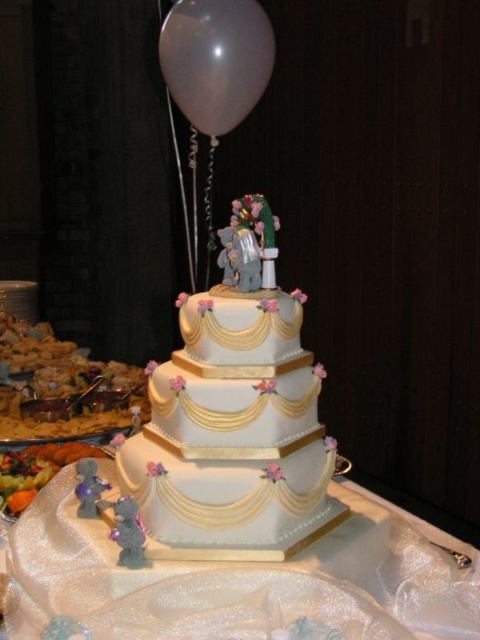
Can you confirm if white fondant cake at center is positioned to the right of white satin tablecloth at center?

In fact, white fondant cake at center is to the left of white satin tablecloth at center.

Between point (298, 524) and point (82, 529), which one is positioned behind?

Point (82, 529)

Identify the location of white fondant cake at center. The height and width of the screenshot is (640, 480). (235, 417).

Which is more to the right, white satin tablecloth at center or white matte balloon at upper center?

Positioned to the right is white satin tablecloth at center.

What do you see at coordinates (237, 580) in the screenshot? I see `white satin tablecloth at center` at bounding box center [237, 580].

Identify the location of white satin tablecloth at center. The width and height of the screenshot is (480, 640). (237, 580).

Looking at this image, which is more to the right, white fondant cake at center or white matte balloon at upper center?

white fondant cake at center is more to the right.

Can you confirm if white fondant cake at center is thinner than white matte balloon at upper center?

Correct, white fondant cake at center's width is less than white matte balloon at upper center's.

Who is more forward, (262,476) or (256,20)?

Point (262,476)

Find the location of a particular element. The height and width of the screenshot is (640, 480). white fondant cake at center is located at coordinates (235, 417).